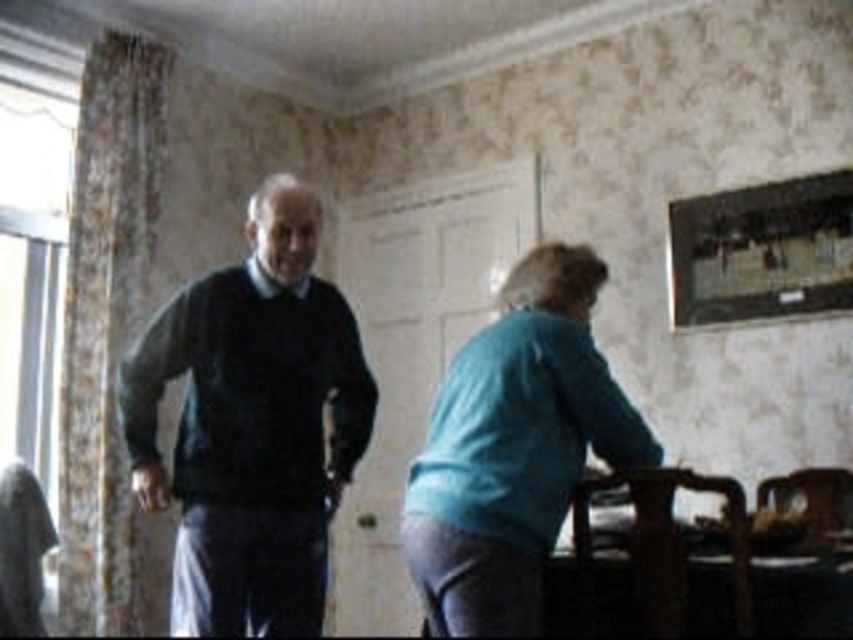
You are organizing a clothing donation drive and need to stack the dark blue sweater at center and the dark gray sweater at center vertically. Which sweater should you place on the bottom to ensure stability?

The dark gray sweater at center should be placed on the bottom because it is thicker than the dark blue sweater at center, providing a more stable base.

From the picture: You are standing at the point labeled point (288,541) and want to walk to the point labeled point (552,372). Is the point you want to reach in front of or behind you?

The point labeled point (552,372) is in front of you because it is ahead of your current position at point (288,541).

You are designing a new clothing line and need to create a size chart based on the image. Which item of clothing has a greater width measurement between the dark gray sweater at center and the teal fabric skirt at lower right?

The dark gray sweater at center has a greater width measurement than the teal fabric skirt at lower right.